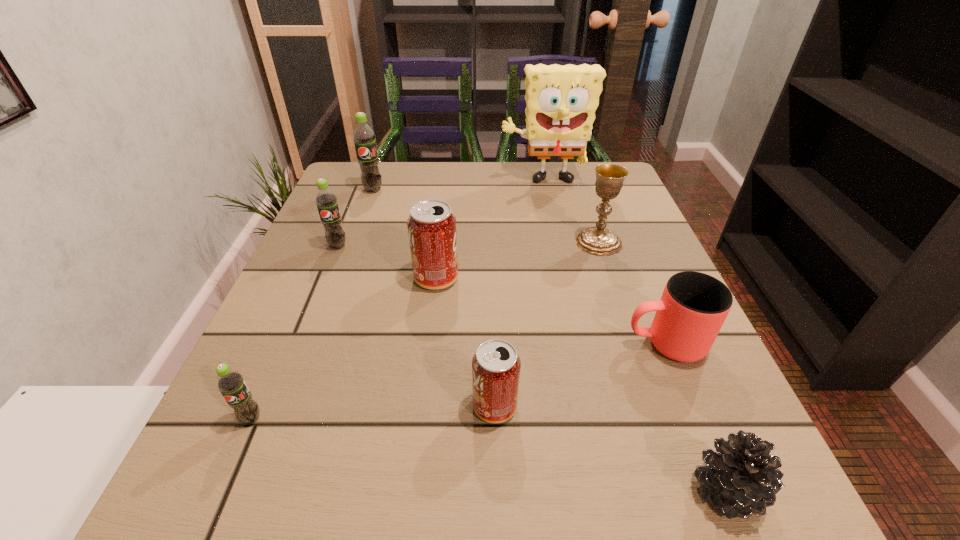
Find the location of `vacant space situated 0.300m on the front of the third nearest soda`. vacant space situated 0.300m on the front of the third nearest soda is located at coordinates (418, 444).

At what (x,y) coordinates should I click in order to perform the action: click on vacant space located 0.210m on the handle side of the fourth nearest object. Please return your answer as a coordinate pair (x, y). The image size is (960, 540). Looking at the image, I should click on (498, 343).

Where is `vacant space located on the handle side of the fourth nearest object`? vacant space located on the handle side of the fourth nearest object is located at coordinates (588, 343).

Image resolution: width=960 pixels, height=540 pixels. I want to click on vacant space located 0.200m on the handle side of the fourth nearest object, so click(x=504, y=343).

This screenshot has width=960, height=540. I want to click on free region located 0.320m on the back of the smaller red soda can, so click(x=491, y=256).

You are a GUI agent. You are given a task and a screenshot of the screen. Output one action in this format:
    pyautogui.click(x=<x>, y=<y>)
    Task: Click on the free spot located on the front label of the smallest green soda
    This screenshot has width=960, height=540.
    Given the screenshot: What is the action you would take?
    pyautogui.click(x=226, y=478)

Where is `free location located 0.160m on the back of the pinecone`? free location located 0.160m on the back of the pinecone is located at coordinates (673, 362).

The image size is (960, 540). I want to click on sponge that is positioned at the far edge, so click(561, 101).

This screenshot has height=540, width=960. I want to click on soda present at the far edge, so click(x=363, y=136).

At what (x,y) coordinates should I click in order to perform the action: click on object located in the near edge section of the desktop. Please return your answer as a coordinate pair (x, y). Looking at the image, I should click on (743, 478).